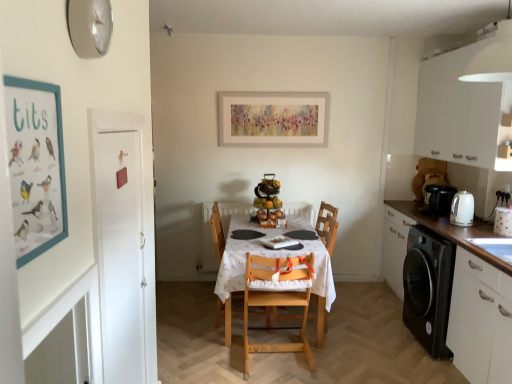
Where is `free point below white ceramic kettle at right, placed as the 2th appliance when sorted from back to front (from a real-world perspective)`? free point below white ceramic kettle at right, placed as the 2th appliance when sorted from back to front (from a real-world perspective) is located at coordinates (506, 231).